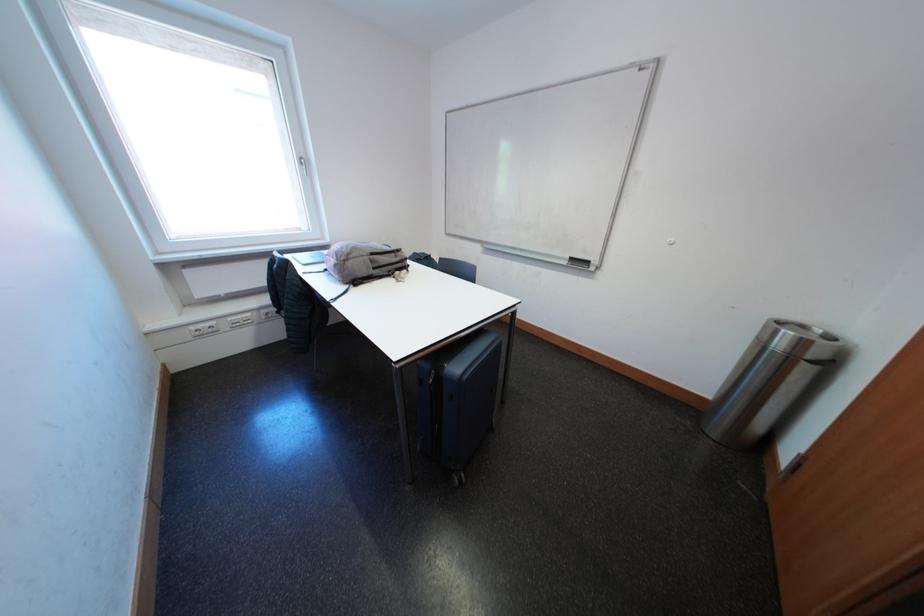
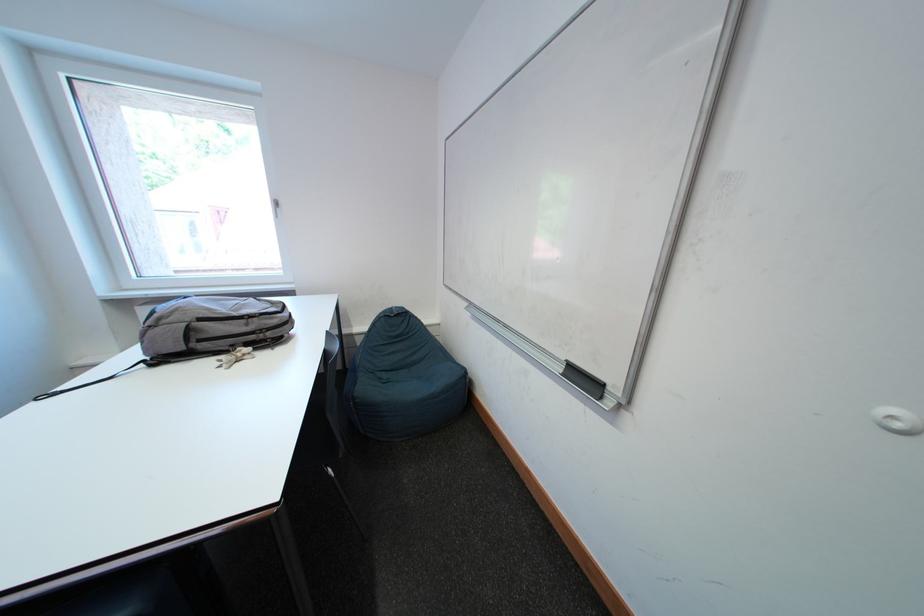
The point at (403, 257) is marked in the first image. Where is the corresponding point in the second image?

(252, 325)